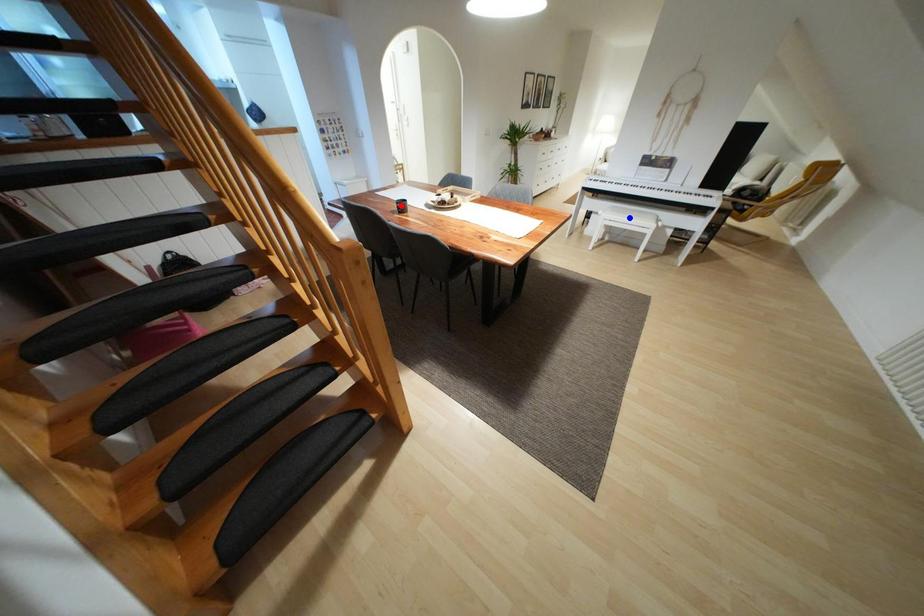
Question: Two points are marked on the image. Which point is closer to the camera?

Choices:
 (A) Blue point is closer.
 (B) Red point is closer.

Answer: (B)